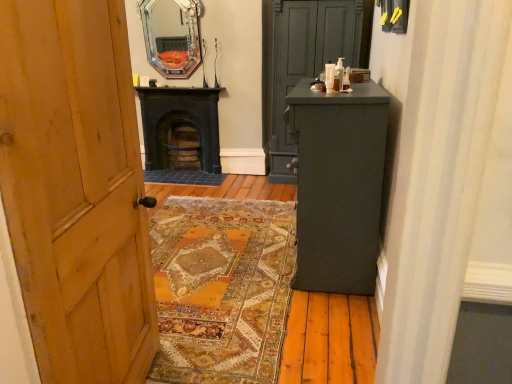
What do you see at coordinates (180, 128) in the screenshot?
I see `black cast iron stove at center` at bounding box center [180, 128].

Identify the location of matte dark gray cabinet at right. The height and width of the screenshot is (384, 512). (338, 185).

Which of these two, matte gray cabinet at center or matte dark gray cabinet at right, is bigger?

matte gray cabinet at center.

Would you say matte gray cabinet at center is inside or outside matte dark gray cabinet at right?

matte gray cabinet at center is outside matte dark gray cabinet at right.

Does matte gray cabinet at center turn towards matte dark gray cabinet at right?

Yes, matte gray cabinet at center is aimed at matte dark gray cabinet at right.

Can you confirm if matte gray cabinet at center is positioned to the right of matte dark gray cabinet at right?

Yes.

Where is `stove located on the right of silver-framed mirror at upper center`? stove located on the right of silver-framed mirror at upper center is located at coordinates (180, 128).

Considering the sizes of objects silver-framed mirror at upper center and black cast iron stove at center in the image provided, who is taller, silver-framed mirror at upper center or black cast iron stove at center?

Standing taller between the two is black cast iron stove at center.

Is silver-framed mirror at upper center oriented towards black cast iron stove at center?

No, silver-framed mirror at upper center is not turned towards black cast iron stove at center.

Would you say black cast iron stove at center is inside or outside matte dark gray cabinet at right?

black cast iron stove at center is not enclosed by matte dark gray cabinet at right.

Considering the sizes of objects black cast iron stove at center and matte dark gray cabinet at right in the image provided, who is taller, black cast iron stove at center or matte dark gray cabinet at right?

With more height is matte dark gray cabinet at right.

Is black cast iron stove at center not close to matte dark gray cabinet at right?

A: Yes, black cast iron stove at center and matte dark gray cabinet at right are quite far apart.

Is black cast iron stove at center thinner than matte dark gray cabinet at right?

Yes, black cast iron stove at center is thinner than matte dark gray cabinet at right.

This screenshot has width=512, height=384. In order to click on mirror behind the matte dark gray cabinet at right in this screenshot , I will do `click(172, 36)`.

In the scene shown: Could you tell me if matte dark gray cabinet at right is turned towards silver-framed mirror at upper center?

No, matte dark gray cabinet at right is not oriented towards silver-framed mirror at upper center.

Is there a large distance between matte dark gray cabinet at right and silver-framed mirror at upper center?

That's right, there is a large distance between matte dark gray cabinet at right and silver-framed mirror at upper center.

From the image's perspective, which one is positioned higher, matte dark gray cabinet at right or silver-framed mirror at upper center?

silver-framed mirror at upper center appears higher in the image.

Who is smaller, silver-framed mirror at upper center or matte dark gray cabinet at right?

silver-framed mirror at upper center is smaller.

Does silver-framed mirror at upper center appear on the left side of matte dark gray cabinet at right?

Yes.

Is silver-framed mirror at upper center oriented towards matte dark gray cabinet at right?

No, silver-framed mirror at upper center is not facing towards matte dark gray cabinet at right.

Considering the relative sizes of silver-framed mirror at upper center and matte dark gray cabinet at right in the image provided, is silver-framed mirror at upper center wider than matte dark gray cabinet at right?

No.

Which is behind, point (211, 115) or point (358, 54)?

The point (211, 115) is behind.

How much distance is there between black cast iron stove at center and matte gray cabinet at center?

3.32 feet.

Consider the image. Which of these two, black cast iron stove at center or matte gray cabinet at center, is bigger?

matte gray cabinet at center.

Is matte gray cabinet at center positioned with its back to silver-framed mirror at upper center?

No, silver-framed mirror at upper center is not at the back of matte gray cabinet at center.

Is matte gray cabinet at center next to silver-framed mirror at upper center and touching it?

No, matte gray cabinet at center is not making contact with silver-framed mirror at upper center.

The image size is (512, 384). In order to click on door located below the silver-framed mirror at upper center (from the image's perspective) in this screenshot , I will do `click(301, 60)`.

Does matte gray cabinet at center have a lesser height compared to silver-framed mirror at upper center?

No.

This screenshot has height=384, width=512. There is a matte dark gray cabinet at right. Find the location of `door above it (from a real-world perspective)`. door above it (from a real-world perspective) is located at coordinates (301, 60).

The image size is (512, 384). Identify the location of mirror in front of the black cast iron stove at center. (172, 36).

From the image, which object appears to be farther from black cast iron stove at center, matte dark gray cabinet at right or silver-framed mirror at upper center?

The object further to black cast iron stove at center is matte dark gray cabinet at right.

When comparing their distances from matte gray cabinet at center, does silver-framed mirror at upper center or matte dark gray cabinet at right seem closer?

Based on the image, silver-framed mirror at upper center appears to be nearer to matte gray cabinet at center.

Which object lies further to the anchor point matte gray cabinet at center, matte dark gray cabinet at right or black cast iron stove at center?

The object further to matte gray cabinet at center is matte dark gray cabinet at right.

Based on their spatial positions, is matte dark gray cabinet at right or matte gray cabinet at center closer to silver-framed mirror at upper center?

matte gray cabinet at center is positioned closer to the anchor silver-framed mirror at upper center.

Which object lies nearer to the anchor point black cast iron stove at center, matte gray cabinet at center or silver-framed mirror at upper center?

silver-framed mirror at upper center.

Estimate the real-world distances between objects in this image. Which object is further from matte gray cabinet at center, black cast iron stove at center or matte dark gray cabinet at right?

matte dark gray cabinet at right.

Estimate the real-world distances between objects in this image. Which object is further from silver-framed mirror at upper center, matte dark gray cabinet at right or black cast iron stove at center?

matte dark gray cabinet at right is positioned further to the anchor silver-framed mirror at upper center.

Which object lies further to the anchor point matte dark gray cabinet at right, silver-framed mirror at upper center or black cast iron stove at center?

silver-framed mirror at upper center is further to matte dark gray cabinet at right.

Where is `door positioned between matte dark gray cabinet at right and silver-framed mirror at upper center from near to far`? The image size is (512, 384). door positioned between matte dark gray cabinet at right and silver-framed mirror at upper center from near to far is located at coordinates (301, 60).

You are a GUI agent. You are given a task and a screenshot of the screen. Output one action in this format:
    pyautogui.click(x=<x>, y=<y>)
    Task: Click on the stove between silver-framed mirror at upper center and matte gray cabinet at center from left to right
    The image size is (512, 384).
    Given the screenshot: What is the action you would take?
    pyautogui.click(x=180, y=128)

Locate an element on the screen. This screenshot has width=512, height=384. door between matte dark gray cabinet at right and black cast iron stove at center in the front-back direction is located at coordinates (301, 60).

Locate an element on the screen. mirror located between matte dark gray cabinet at right and black cast iron stove at center in the depth direction is located at coordinates (172, 36).